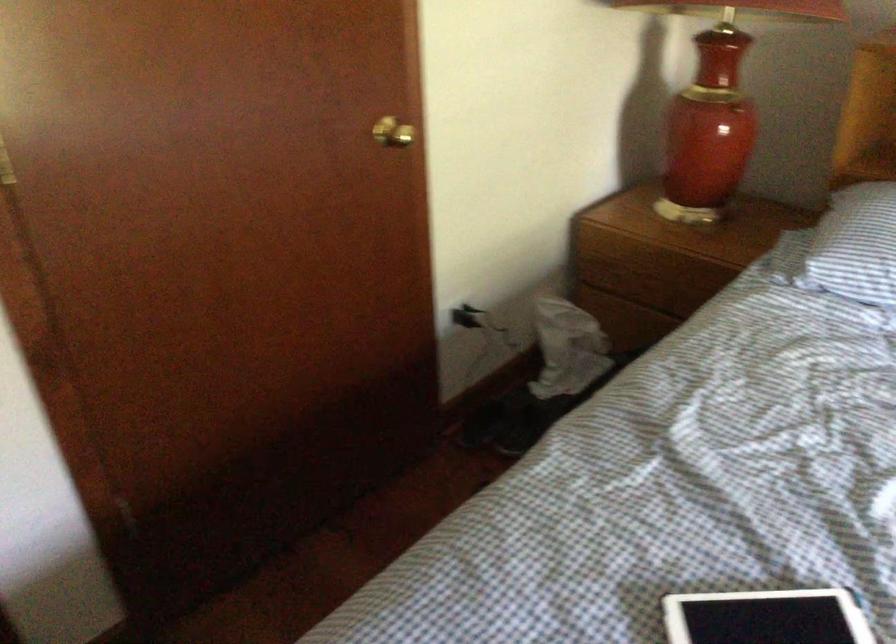
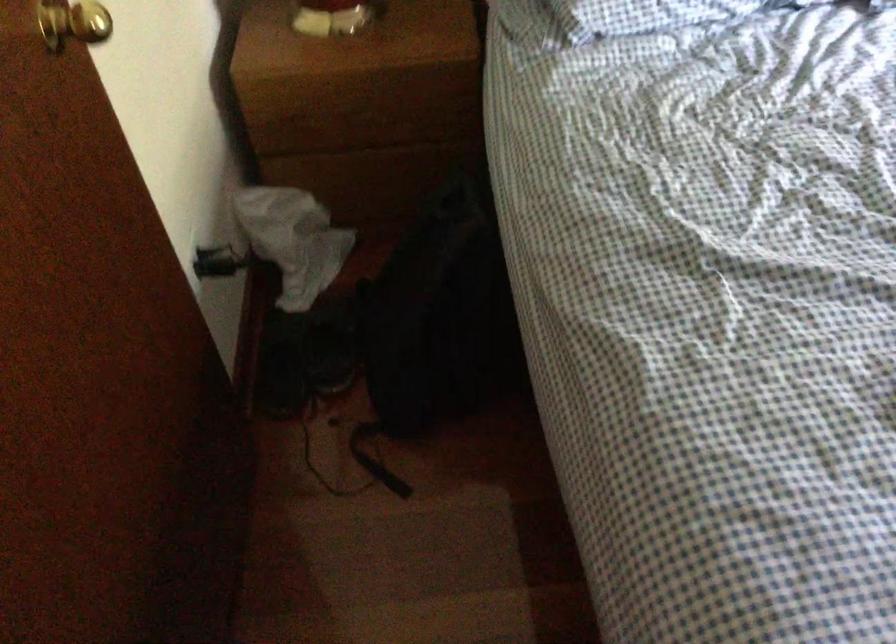
Find the pixel in the second image that matches pixel 497 418 in the first image.

(282, 363)